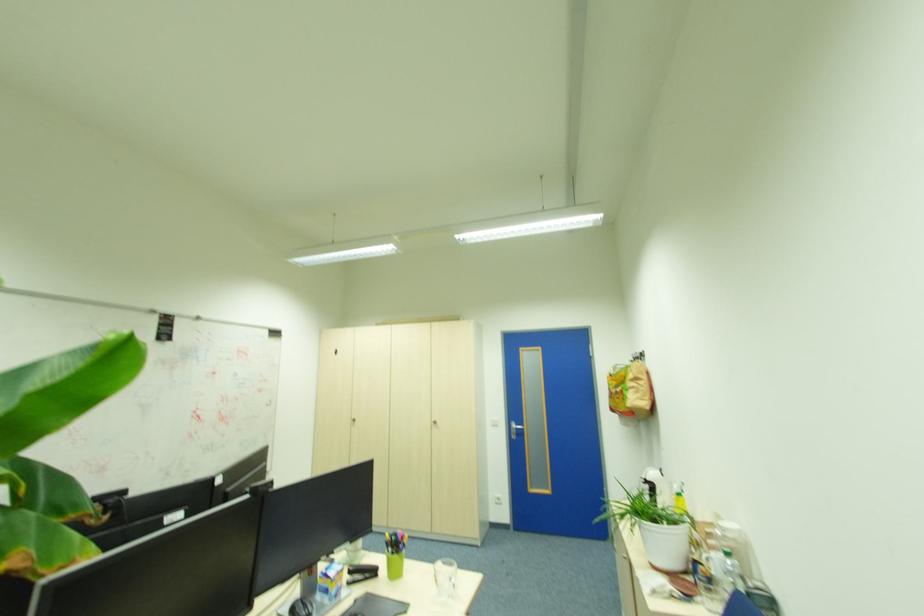
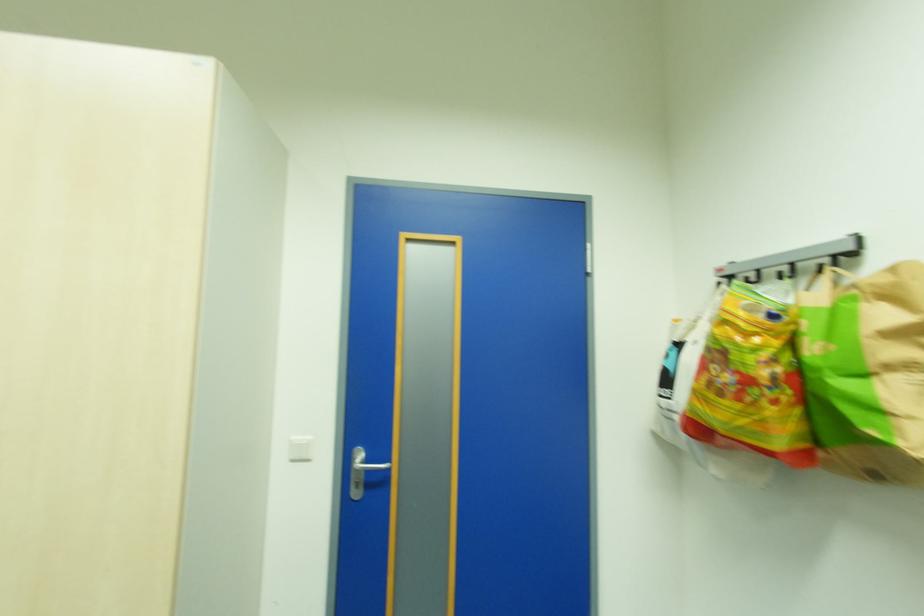
Question: In a continuous first-person perspective shot, in which direction is the camera moving?

Choices:
 (A) Left
 (B) Right
 (C) Forward
 (D) Backward

Answer: (C)